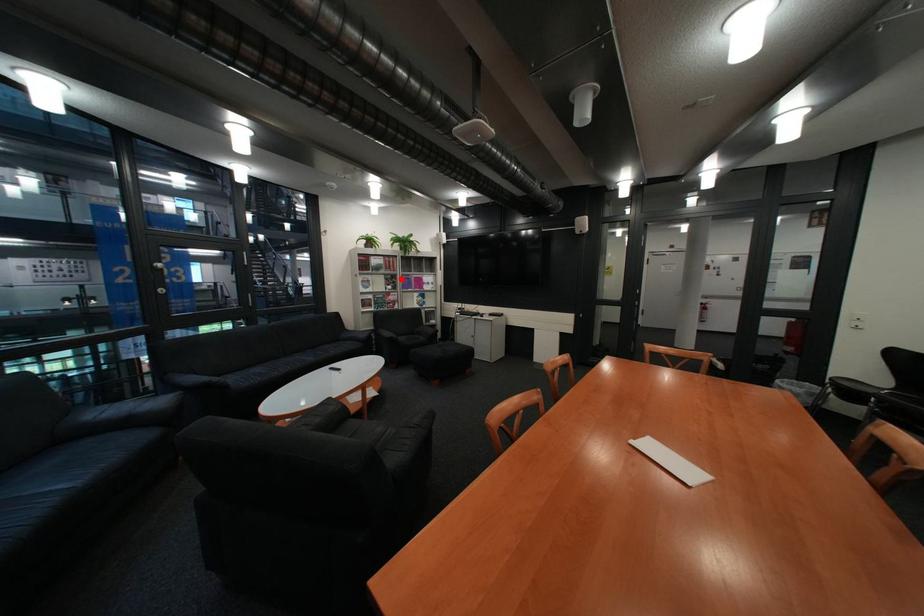
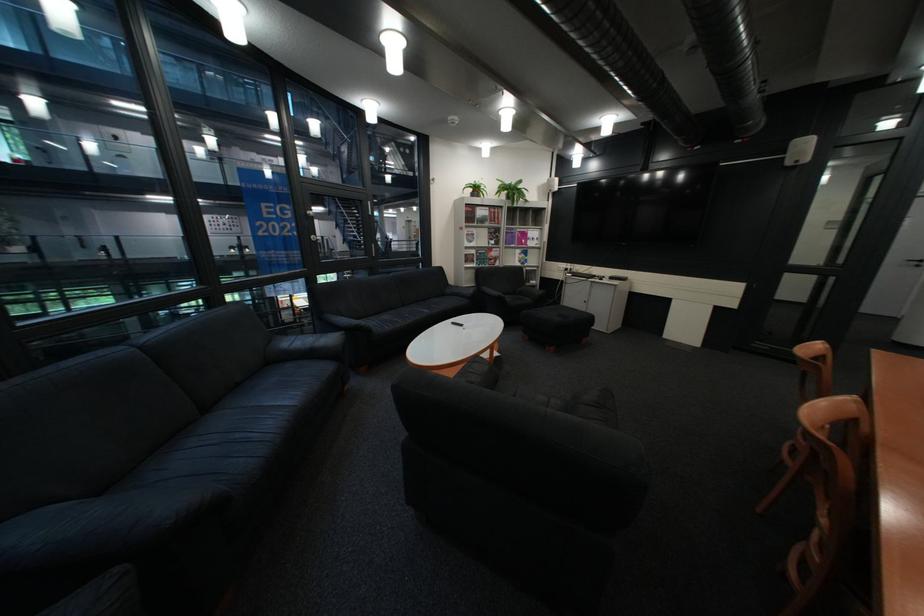
The point at the highlighted location is marked in the first image. Where is the corresponding point in the second image?

(505, 233)